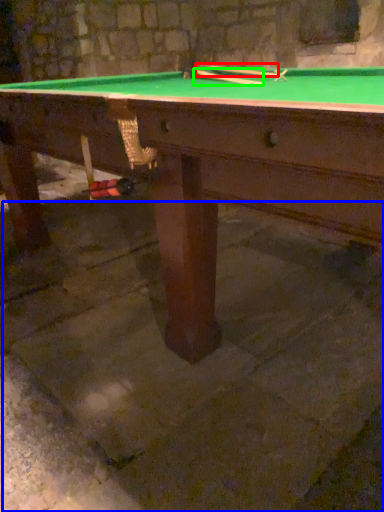
Question: Which is farther away from cue (highlighted by a red box)? concrete (highlighted by a blue box) or cue (highlighted by a green box)?

Choices:
 (A) concrete
 (B) cue

Answer: (A)